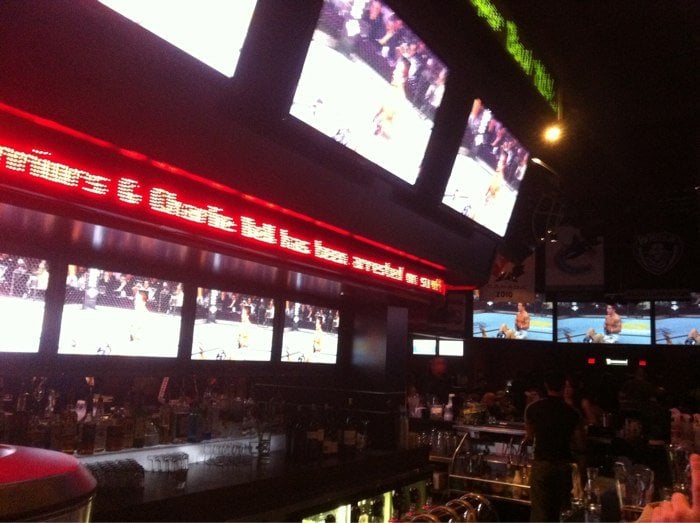
At what (x,y) coordinates should I click in order to perform the action: click on shelf. Please return your answer as a coordinate pair (x, y). The height and width of the screenshot is (523, 700). Looking at the image, I should click on (481, 426), (112, 449).